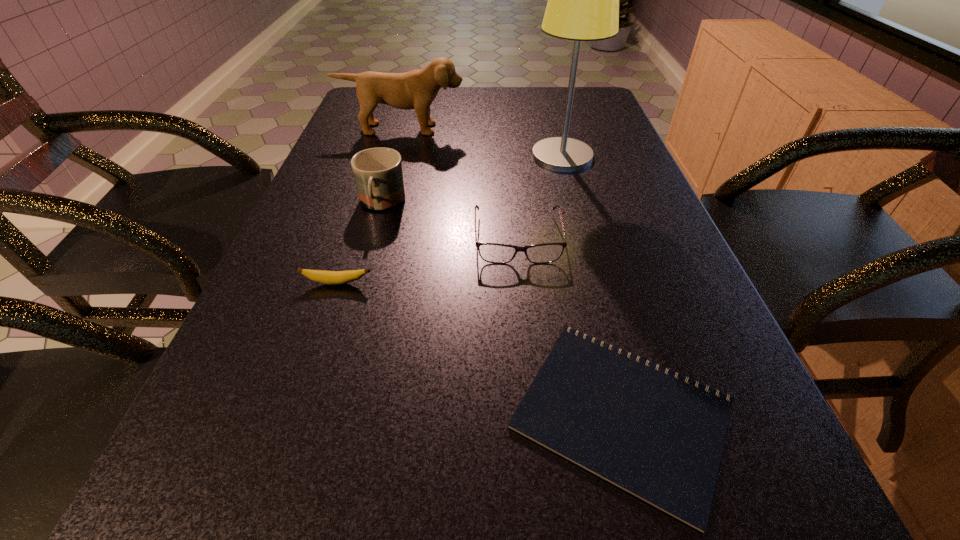
This screenshot has height=540, width=960. Identify the location of free location located 0.130m on the back of the second farthest object. (552, 119).

Find the location of a particular element. free location located on the left side of the puppy is located at coordinates (x=382, y=200).

Locate an element on the screen. vacant space located 0.340m on the side with the handle of the fourth shortest object is located at coordinates (339, 359).

Locate an element on the screen. The image size is (960, 540). free spot located on the lenses of the spectacles is located at coordinates pos(528,352).

At what (x,y) coordinates should I click in order to perform the action: click on vacant position located on the front of the second nearest object. Please return your answer as a coordinate pair (x, y). Image resolution: width=960 pixels, height=540 pixels. Looking at the image, I should click on (300, 397).

In order to click on vacant space situated on the back of the notepad in this screenshot , I will do [x=590, y=290].

You are a GUI agent. You are given a task and a screenshot of the screen. Output one action in this format:
    pyautogui.click(x=<x>, y=<y>)
    Task: Click on the puppy positioned at the left edge
    
    Given the screenshot: What is the action you would take?
    pyautogui.click(x=417, y=89)

Locate an element on the screen. mug that is at the left edge is located at coordinates (378, 172).

You are a GUI agent. You are given a task and a screenshot of the screen. Output one action in this format:
    pyautogui.click(x=<x>, y=<y>)
    Task: Click on the banana at the left edge
    This screenshot has width=960, height=540.
    Given the screenshot: What is the action you would take?
    pyautogui.click(x=327, y=277)

At what (x,y) coordinates should I click in order to perform the action: click on table lamp located at the right edge. Please return your answer as a coordinate pair (x, y). This screenshot has width=960, height=540. Looking at the image, I should click on (583, 0).